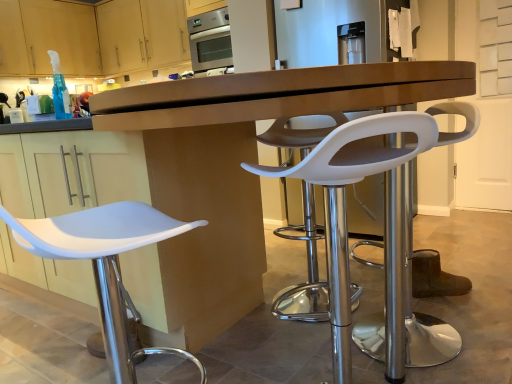
Image resolution: width=512 pixels, height=384 pixels. What are the coordinates of `free spot to the right of white plastic stool at center, the first chair in the right-to-left sequence` in the screenshot? It's located at (476, 322).